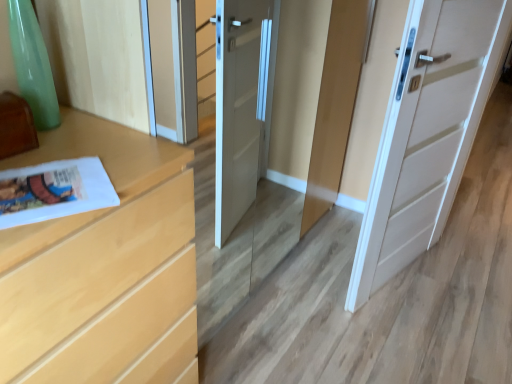
Where is `unoccupied space behind white glossy magazine at lower left`? This screenshot has width=512, height=384. unoccupied space behind white glossy magazine at lower left is located at coordinates pos(83,145).